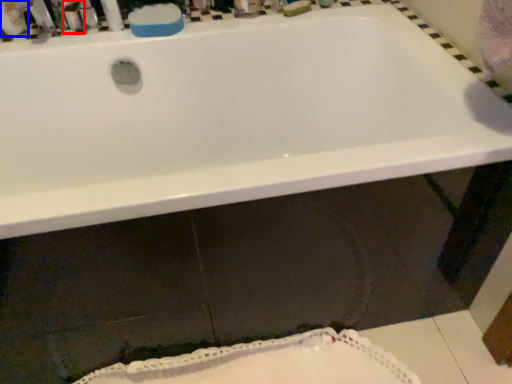
Question: Which of the following is the closest to the observer, toiletry (highlighted by a red box) or mouthwash (highlighted by a blue box)?

Choices:
 (A) toiletry
 (B) mouthwash

Answer: (B)